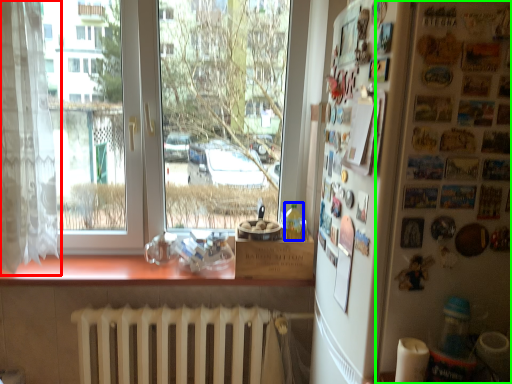
Question: Which object is the farthest from curtain (highlighted by a red box)? Choose among these: bottle (highlighted by a blue box) or bulletin board (highlighted by a green box).

Choices:
 (A) bottle
 (B) bulletin board

Answer: (B)